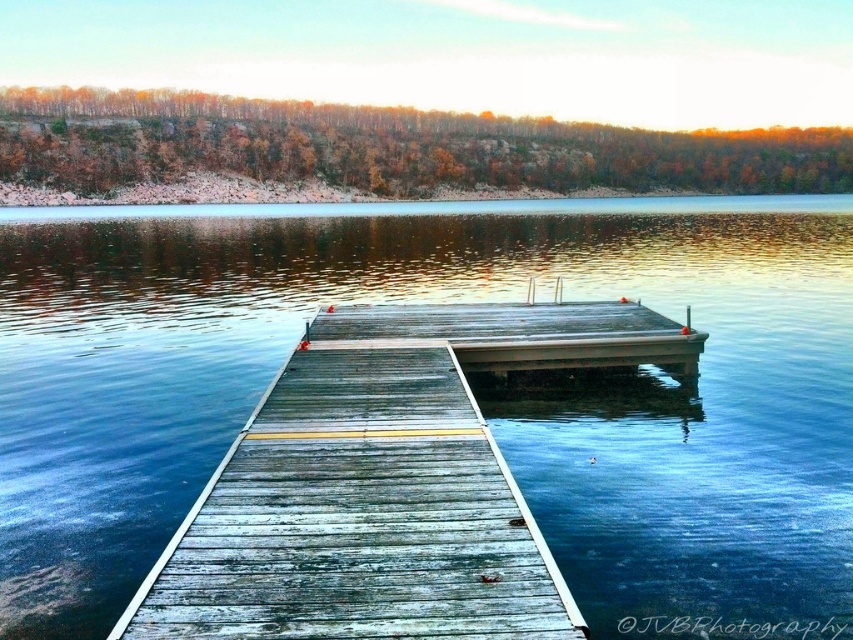
In the scene shown: You are standing at the edge of the lake and want to place a small floating dock exactly where the transparent blue water at center is located. According to the coordinates given, where should you position the dock?

The transparent blue water at center is located at coordinates point (469, 381), so the dock should be placed there.

You are standing on the weathered wood dock at center and want to look towards the direction where the transparent blue water at center is located. Which direction should you face?

You should face to the right because the transparent blue water at center is to the right of the weathered wood dock at center.